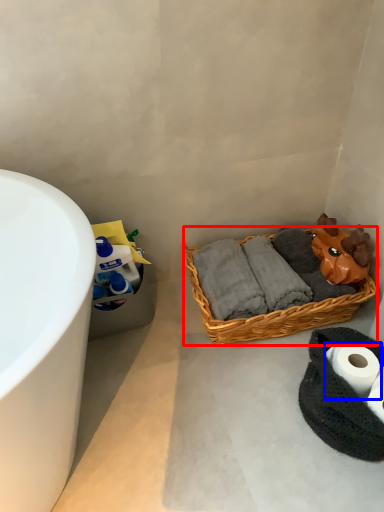
Question: Among these objects, which one is nearest to the camera, picnic basket (highlighted by a red box) or toilet paper (highlighted by a blue box)?

Choices:
 (A) picnic basket
 (B) toilet paper

Answer: (B)